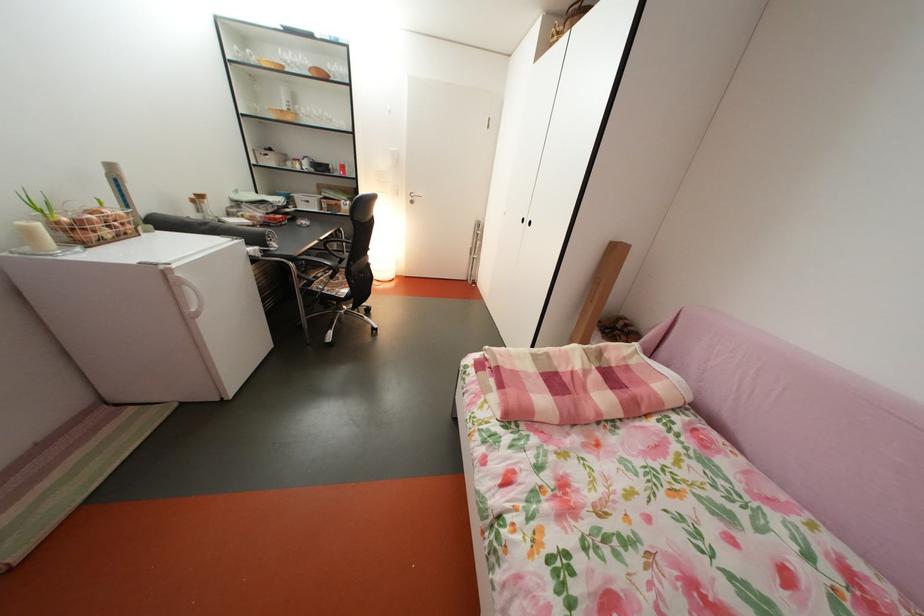
Where would you pull the black cabinet handle? Please return your answer as a coordinate pair (x, y).

(529, 223)